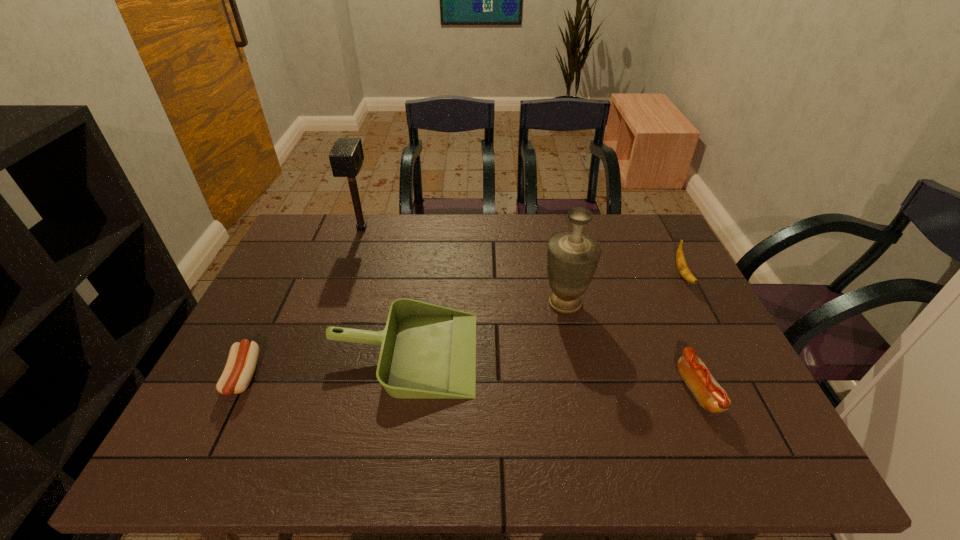
You are a GUI agent. You are given a task and a screenshot of the screen. Output one action in this format:
    pyautogui.click(x=<x>, y=<y>)
    Task: Click on the empty location between the mallet and the rightmost object
    The width and height of the screenshot is (960, 540).
    Given the screenshot: What is the action you would take?
    pyautogui.click(x=522, y=252)

Locate an element on the screen. The height and width of the screenshot is (540, 960). object that is the closest to the taller sausage is located at coordinates (572, 257).

Find the location of `the fourth closest object to the mallet`. the fourth closest object to the mallet is located at coordinates (682, 266).

You are a GUI agent. You are given a task and a screenshot of the screen. Output one action in this format:
    pyautogui.click(x=<x>, y=<y>)
    Task: Click on the vacant space that satisfies the following two spatial constraints: 1. on the back side of the mallet; 2. on the right side of the shortest object
    
    Given the screenshot: What is the action you would take?
    pyautogui.click(x=315, y=228)

Where is `free space that satisfies the following two spatial constraints: 1. on the back side of the shorter sausage; 2. on the left side of the urn`? free space that satisfies the following two spatial constraints: 1. on the back side of the shorter sausage; 2. on the left side of the urn is located at coordinates (279, 303).

I want to click on free point that satisfies the following two spatial constraints: 1. on the peel of the banana from the top; 2. on the scoop of the dustpan, so click(724, 353).

The height and width of the screenshot is (540, 960). What are the coordinates of `vacant space that satisfies the following two spatial constraints: 1. on the front side of the fourth object from left to right; 2. on the right side of the mallet` in the screenshot? It's located at (336, 303).